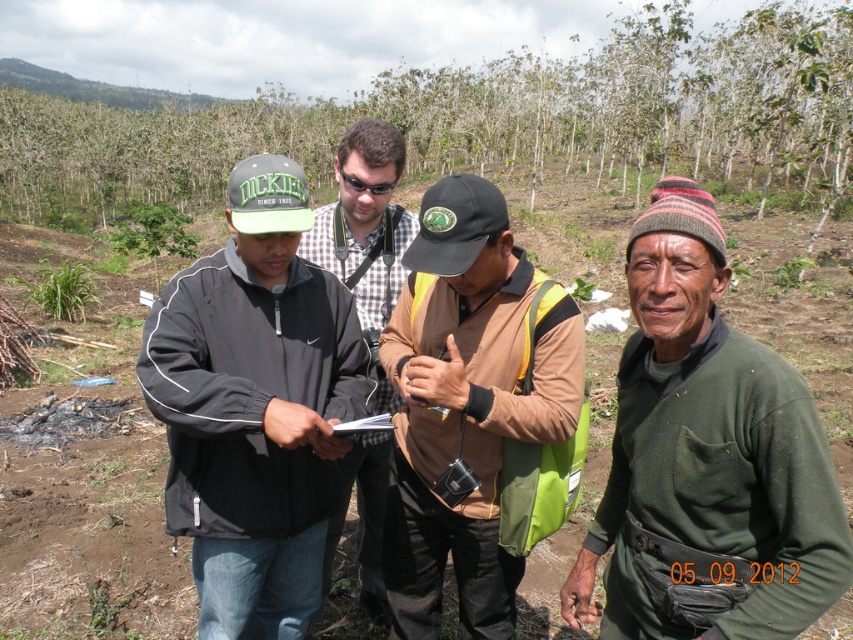
Question: Estimate the real-world distances between objects in this image. Which object is farther from the green cotton shirt at right?

Choices:
 (A) black matte jacket at center
 (B) green leafy tree at upper center
 (C) checkered fabric shirt at center

Answer: (B)

Question: Can you confirm if black matte jacket at center is thinner than brown fabric shirt at center?

Choices:
 (A) yes
 (B) no

Answer: (B)

Question: Is brown fabric shirt at center thinner than checkered fabric shirt at center?

Choices:
 (A) no
 (B) yes

Answer: (A)

Question: Considering the real-world distances, which object is farthest from the brown fabric shirt at center?

Choices:
 (A) checkered fabric shirt at center
 (B) green cotton shirt at right
 (C) green leafy tree at upper center
 (D) black plastic goggles at center

Answer: (C)

Question: Which of these objects is positioned farthest from the black matte jacket at center?

Choices:
 (A) green leafy tree at upper center
 (B) green cotton shirt at right
 (C) brown fabric shirt at center

Answer: (A)

Question: Is green cotton shirt at right positioned in front of black matte jacket at center?

Choices:
 (A) yes
 (B) no

Answer: (A)